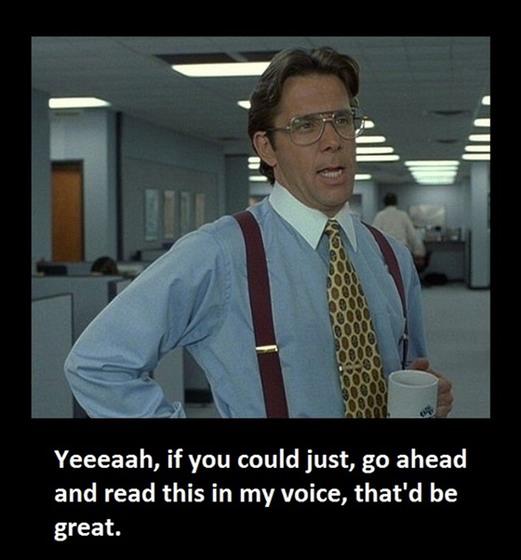
This screenshot has height=560, width=521. What are the coordinates of `cup` in the screenshot? It's located at (411, 400).